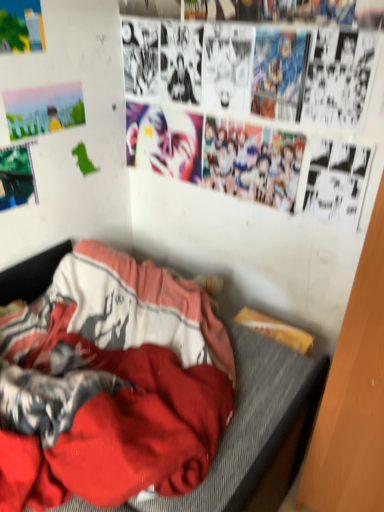
Question: Is matte paper poster at upper left, acting as the 1th poster page starting from the top, surrounding metallic green poster at upper left, the 3th poster page when ordered from top to bottom?

Choices:
 (A) no
 (B) yes

Answer: (A)

Question: From the image's perspective, would you say matte paper poster at upper left, the third poster page ordered from the bottom, is shown under metallic green poster at upper left, which ranks as the first poster page in bottom-to-top order?

Choices:
 (A) no
 (B) yes

Answer: (A)

Question: Is matte paper poster at upper left, the third poster page ordered from the bottom, facing away from metallic green poster at upper left, the 3th poster page when ordered from top to bottom?

Choices:
 (A) yes
 (B) no

Answer: (B)

Question: Is matte paper poster at upper left, the third poster page ordered from the bottom, at the left side of metallic green poster at upper left, the 3th poster page when ordered from top to bottom?

Choices:
 (A) no
 (B) yes

Answer: (A)

Question: Considering the relative sizes of matte paper poster at upper left, the third poster page ordered from the bottom, and metallic green poster at upper left, which ranks as the first poster page in bottom-to-top order, in the image provided, is matte paper poster at upper left, the third poster page ordered from the bottom, wider than metallic green poster at upper left, which ranks as the first poster page in bottom-to-top order,?

Choices:
 (A) no
 (B) yes

Answer: (B)

Question: From a real-world perspective, relative to shiny metallic mask at upper center, is watercolor paper poster at upper left, the 2th poster page viewed from the top, vertically above or below?

Choices:
 (A) below
 (B) above

Answer: (B)

Question: Relative to shiny metallic mask at upper center, is watercolor paper poster at upper left, the 2th poster page viewed from the top, in front or behind?

Choices:
 (A) behind
 (B) front

Answer: (B)

Question: Considering the positions of watercolor paper poster at upper left, which is the second poster page in bottom-to-top order, and shiny metallic mask at upper center in the image, is watercolor paper poster at upper left, which is the second poster page in bottom-to-top order, bigger or smaller than shiny metallic mask at upper center?

Choices:
 (A) small
 (B) big

Answer: (A)

Question: Considering the relative positions of watercolor paper poster at upper left, the 2th poster page viewed from the top, and shiny metallic mask at upper center in the image provided, is watercolor paper poster at upper left, the 2th poster page viewed from the top, to the left or to the right of shiny metallic mask at upper center?

Choices:
 (A) right
 (B) left

Answer: (B)

Question: Looking at the image, does metallic green poster at upper left, which ranks as the first poster page in bottom-to-top order, seem bigger or smaller compared to shiny metallic mask at upper center?

Choices:
 (A) big
 (B) small

Answer: (B)

Question: In the image, is metallic green poster at upper left, the 3th poster page when ordered from top to bottom, positioned in front of or behind shiny metallic mask at upper center?

Choices:
 (A) front
 (B) behind

Answer: (A)

Question: Based on their positions, is metallic green poster at upper left, which ranks as the first poster page in bottom-to-top order, located to the left or right of shiny metallic mask at upper center?

Choices:
 (A) left
 (B) right

Answer: (A)

Question: From a real-world perspective, relative to shiny metallic mask at upper center, is metallic green poster at upper left, which ranks as the first poster page in bottom-to-top order, vertically above or below?

Choices:
 (A) below
 (B) above

Answer: (A)

Question: In the image, is matte paper poster at upper left, acting as the 1th poster page starting from the top, positioned in front of or behind watercolor paper poster at upper left, which is the second poster page in bottom-to-top order?

Choices:
 (A) front
 (B) behind

Answer: (A)

Question: In terms of height, does matte paper poster at upper left, the third poster page ordered from the bottom, look taller or shorter compared to watercolor paper poster at upper left, the 2th poster page viewed from the top?

Choices:
 (A) short
 (B) tall

Answer: (B)